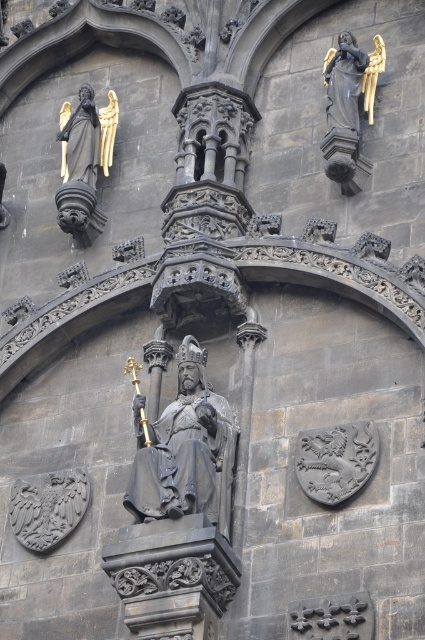
Does polished bronze statue at center have a smaller size compared to gold leaf statue at upper left?

No, polished bronze statue at center is not smaller than gold leaf statue at upper left.

Between point (136, 396) and point (102, 129), which one is positioned in front?

Point (136, 396) is in front.

Describe the element at coordinates (186, 451) in the screenshot. I see `polished bronze statue at center` at that location.

The image size is (425, 640). Find the location of `polished bronze statue at center`. polished bronze statue at center is located at coordinates (186, 451).